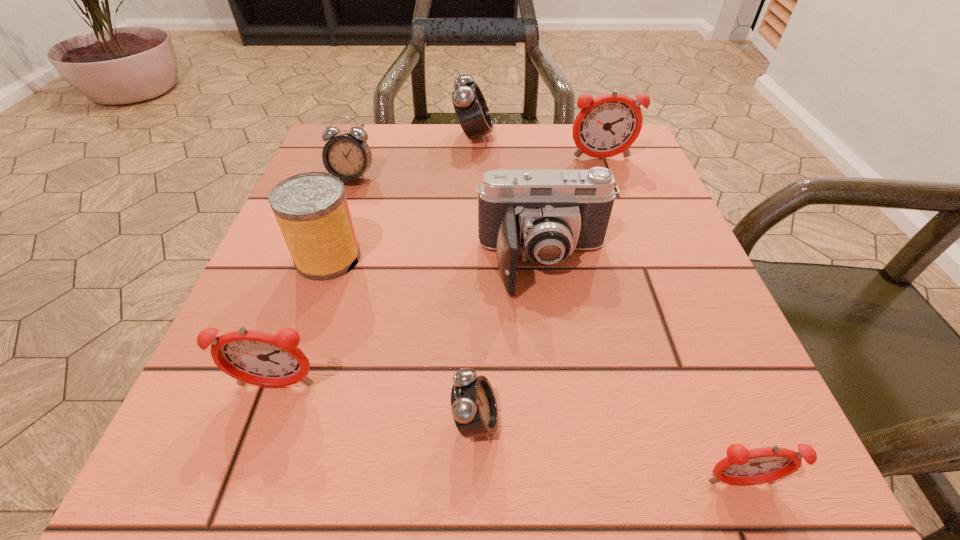
Identify the location of vacant space located on the face of the smallest white alarm clock. The image size is (960, 540). (749, 421).

This screenshot has width=960, height=540. What are the coordinates of `can located in the left edge section of the desktop` in the screenshot? It's located at (311, 209).

Find the location of a particular element. Image resolution: width=960 pixels, height=540 pixels. camera situated at the right edge is located at coordinates (544, 215).

At what (x,y) coordinates should I click in order to perform the action: click on object located at the far left corner. Please return your answer as a coordinate pair (x, y). This screenshot has width=960, height=540. Looking at the image, I should click on (347, 156).

Where is `object at the far right corner`? object at the far right corner is located at coordinates (608, 125).

Identify the location of object that is at the near right corner. This screenshot has height=540, width=960. (741, 466).

Find the location of a particular element. This screenshot has width=960, height=540. free space at the far edge of the desktop is located at coordinates (385, 178).

In order to click on free location at the near edge in this screenshot , I will do `click(529, 474)`.

This screenshot has width=960, height=540. In order to click on vacant position at the left edge of the desktop in this screenshot , I will do `click(355, 287)`.

In the image, there is a desktop. Where is `vacant space at the right edge`? Image resolution: width=960 pixels, height=540 pixels. vacant space at the right edge is located at coordinates tap(658, 220).